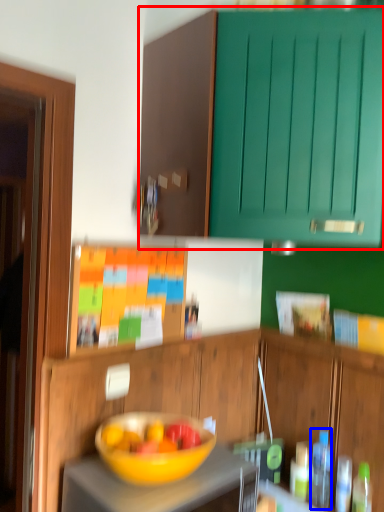
Question: Which point is closer to the camera, cabinetry (highlighted by a red box) or bottle (highlighted by a blue box)?

Choices:
 (A) cabinetry
 (B) bottle

Answer: (A)